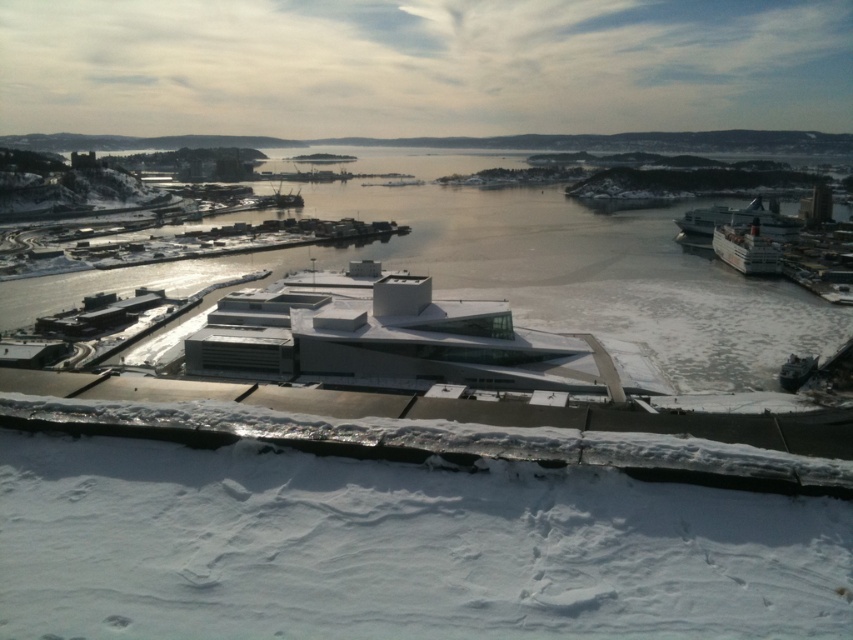
You are a photographer standing on the snow covered rooftop in the foreground. You want to take a photo of the clear water at center and the white glossy cruise ship at right. Which object should you pan your camera to the left to capture?

To capture the clear water at center, you should pan your camera to the left since it is positioned on the left side of the white glossy cruise ship at right.

You are a photographer planning to capture the cruise ship at the harbor. You notice the clear water at center and the white glossy cruise ship at right. Which object is positioned higher in the image?

The clear water at center is located above the white glossy cruise ship at right, so it is positioned higher in the image.